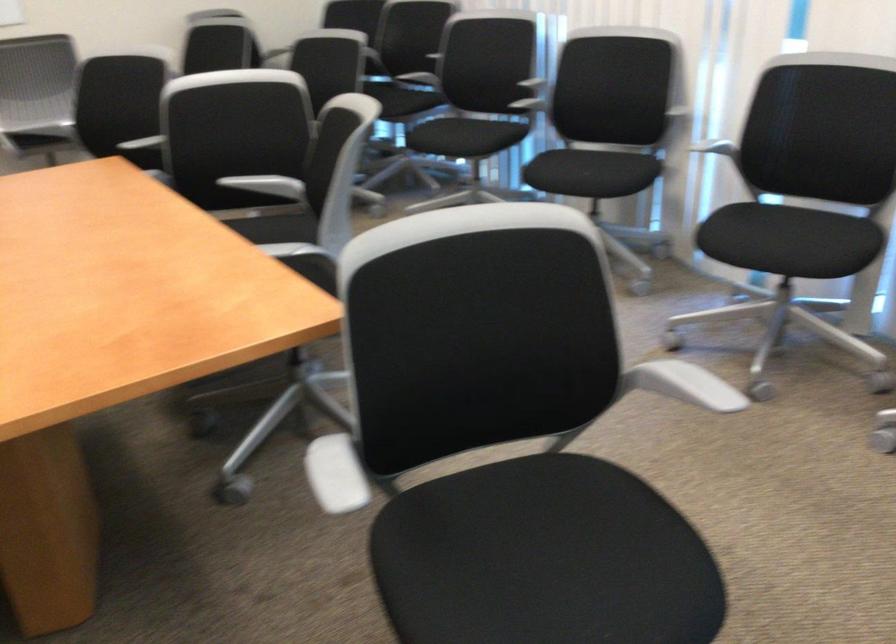
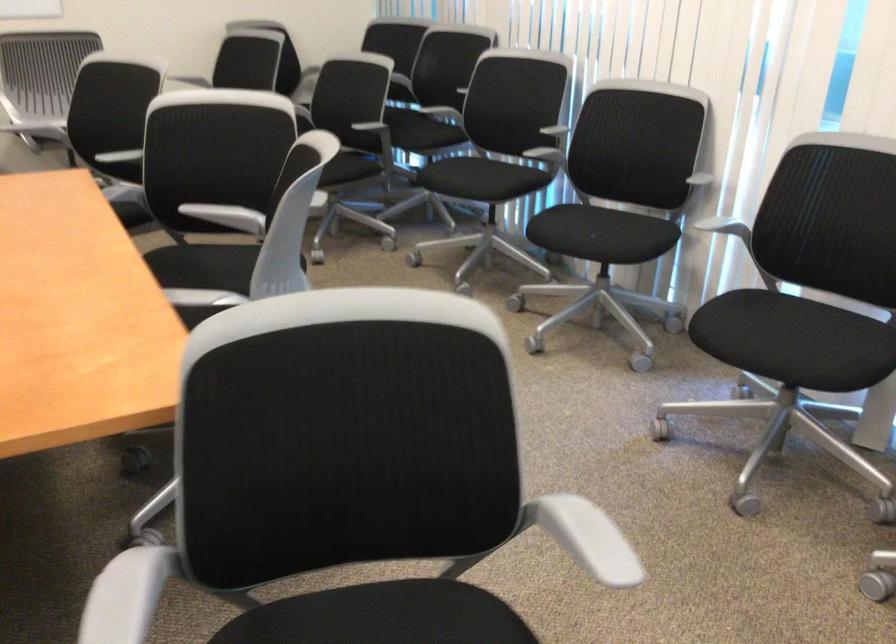
Find the pixel in the second image that matches (244,185) in the first image.

(208, 212)